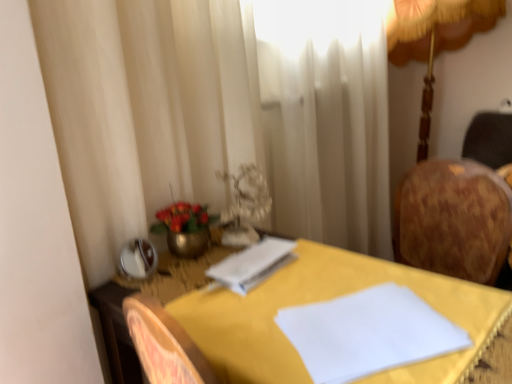
Locate an element on the screen. The width and height of the screenshot is (512, 384). vacant space in front of metallic gold vase at center is located at coordinates (185, 288).